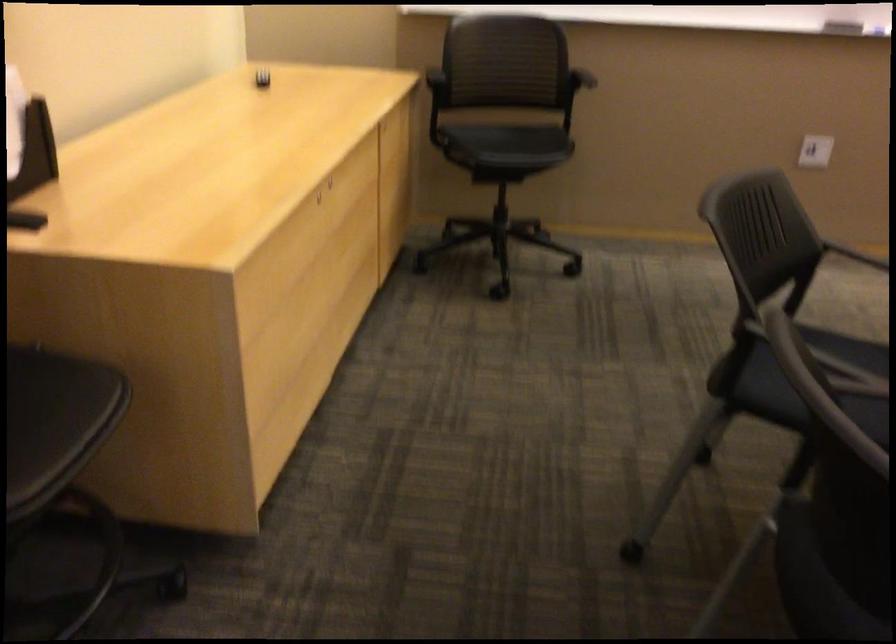
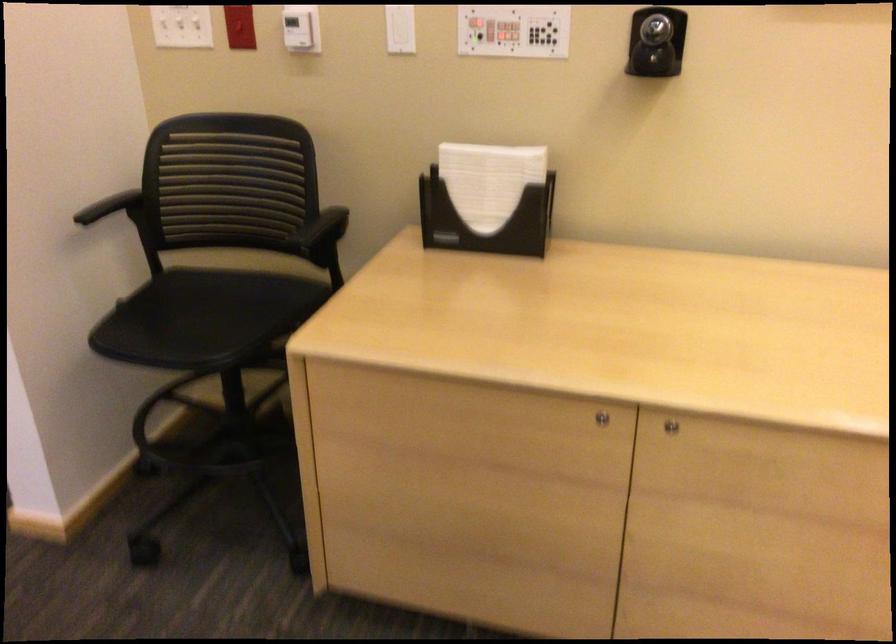
Find the pixel in the second image that matches (x=330, y=225) in the first image.

(600, 418)